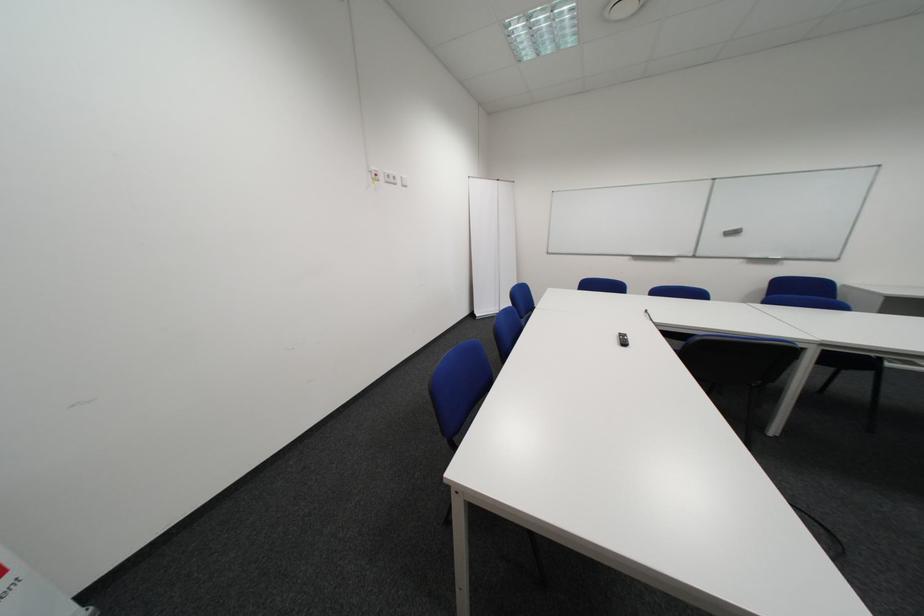
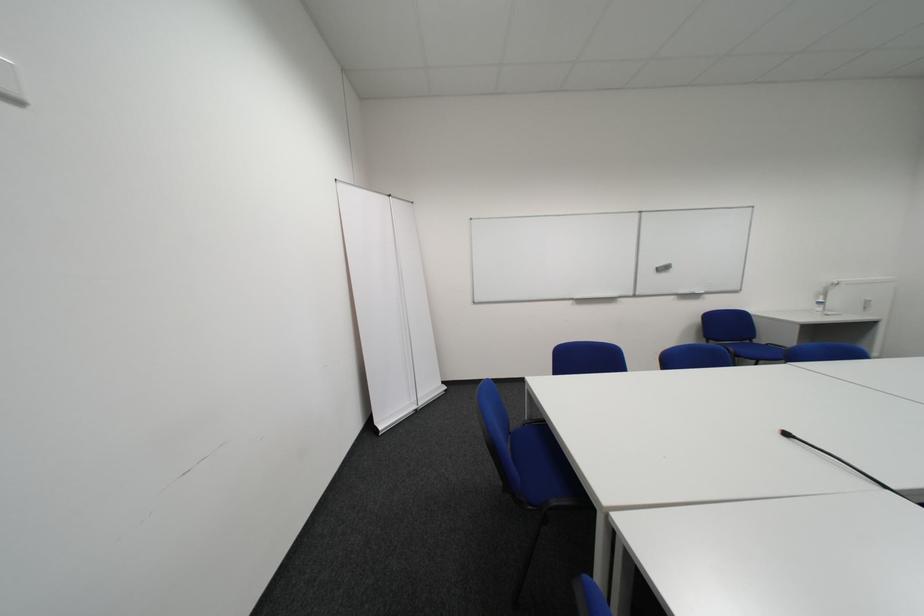
Question: In a continuous first-person perspective shot, in which direction is the camera moving?

Choices:
 (A) Left
 (B) Right
 (C) Forward
 (D) Backward

Answer: (C)